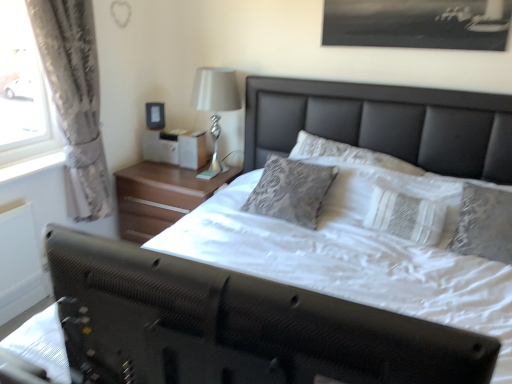
Question: Looking at their shapes, would you say matte black picture frame at upper center is wider or thinner than white fabric bed at center?

Choices:
 (A) thin
 (B) wide

Answer: (A)

Question: From the image's perspective, is matte black picture frame at upper center positioned above or below white fabric bed at center?

Choices:
 (A) above
 (B) below

Answer: (A)

Question: Estimate the real-world distances between objects in this image. Which object is closer to the white fabric bed at center?

Choices:
 (A) wooden nightstand at center
 (B) matte black picture frame at upper center
 (C) white textured pillow at center
 (D) white textured curtain at left
 (E) white glossy lamp at upper right

Answer: (C)

Question: Based on their relative distances, which object is nearer to the white textured curtain at left?

Choices:
 (A) wooden nightstand at center
 (B) white glossy lamp at upper right
 (C) white textured pillow at center
 (D) matte black picture frame at upper center
 (E) white fabric bed at center

Answer: (A)